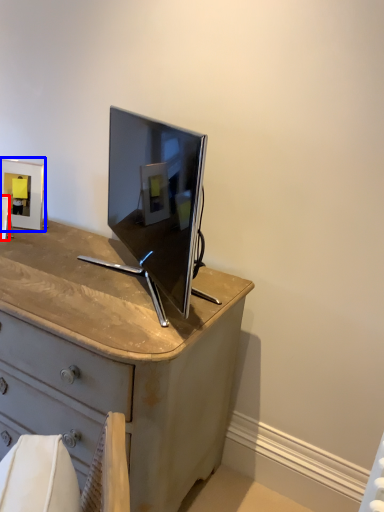
Question: Which object appears closest to the camera in this image, picture frame (highlighted by a red box) or picture frame (highlighted by a blue box)?

Choices:
 (A) picture frame
 (B) picture frame

Answer: (A)